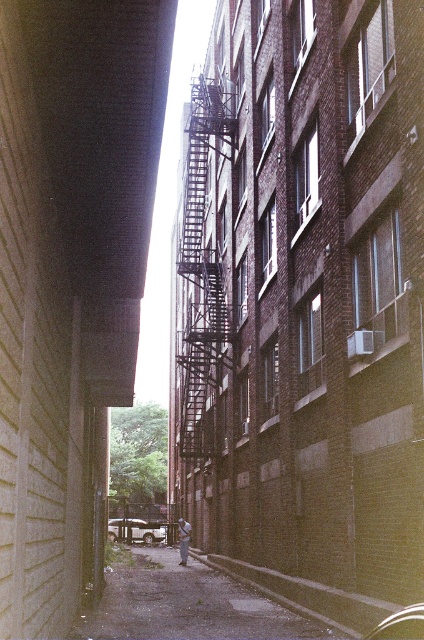
Question: Which of the following is the closest to the observer?

Choices:
 (A) metallic fire escape at center
 (B) concrete sidewalk at center

Answer: (B)

Question: In this image, where is concrete sidewalk at center located relative to metallic fire escape at center?

Choices:
 (A) left
 (B) right

Answer: (A)

Question: Does concrete sidewalk at center appear on the left side of metallic fire escape at center?

Choices:
 (A) yes
 (B) no

Answer: (A)

Question: Does concrete sidewalk at center appear on the left side of metallic fire escape at center?

Choices:
 (A) yes
 (B) no

Answer: (A)